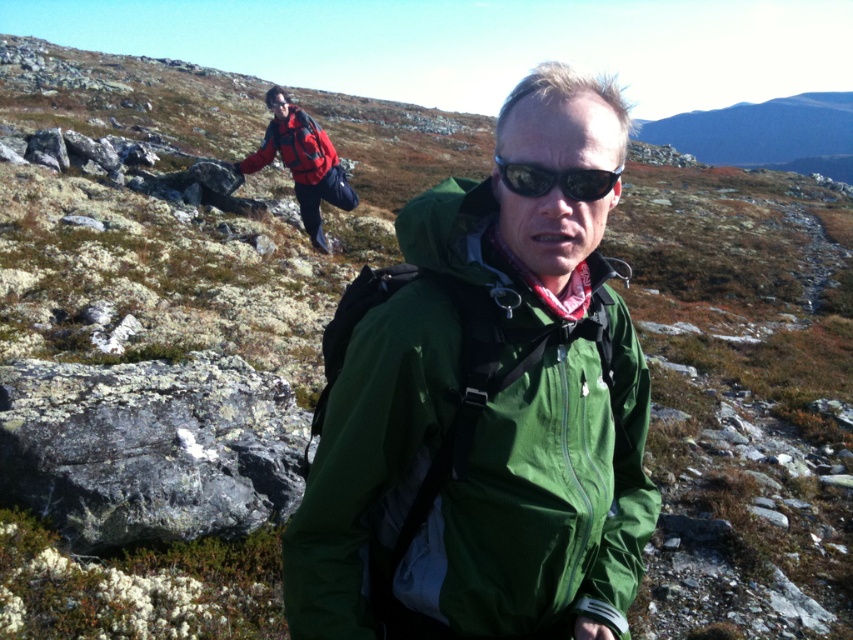
You are a photographer trying to capture both the green fabric jacket at center and the matte red jacket at upper left in a single frame. Based on their positions, which jacket will appear larger in the photo?

The green fabric jacket at center will appear larger in the photo because it is closer to the camera than the matte red jacket at upper left.

You are a hiker trying to navigate the rocky terrain. There are two points marked on your map at coordinates point (421, 346) and point (532, 192). If you are currently at the point closer to the camera, which coordinate should you move towards to continue forward along the path?

You should move towards point (421, 346) because it is behind point (532, 192), meaning it is further along the path from your current position.

You are a photographer trying to capture both the red fleece jacket at upper left and the sunglasses at center in a single frame. Based on their positions, which object should you focus on first to ensure both are in the frame?

The red fleece jacket at upper left is located above sunglasses at center, so you should focus on the sunglasses at center first to ensure both are included in the frame.